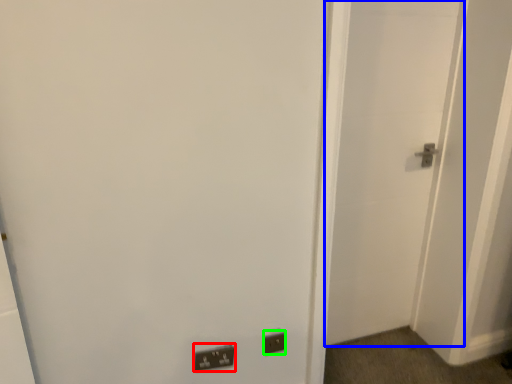
Question: Based on their relative distances, which object is farther from light switch (highlighted by a red box)? Choose from door (highlighted by a blue box) and electric outlet (highlighted by a green box).

Choices:
 (A) door
 (B) electric outlet

Answer: (A)